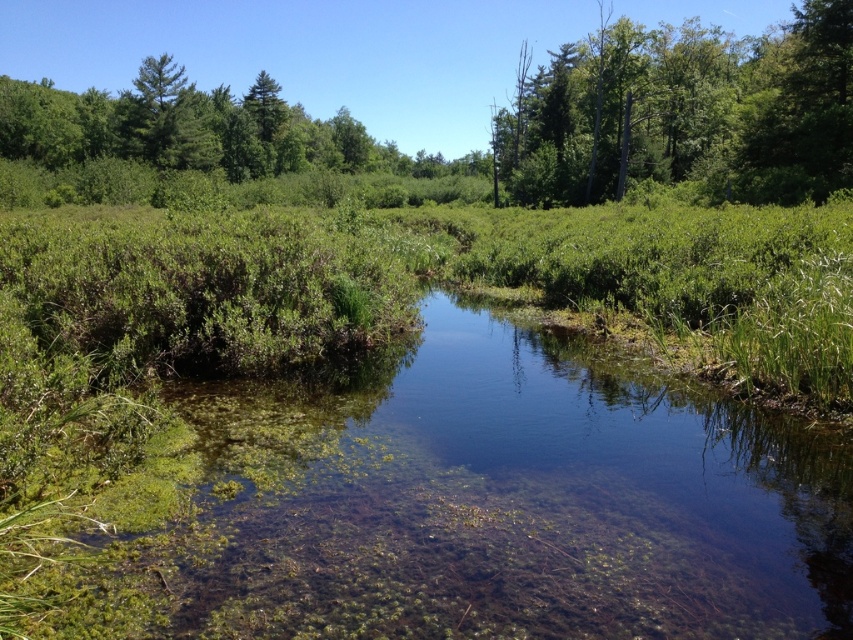
Is green algae-covered water at center to the left of green leafy trees at upper center from the viewer's perspective?

Indeed, green algae-covered water at center is positioned on the left side of green leafy trees at upper center.

Between green algae-covered water at center and green leafy trees at upper center, which one has less height?

With less height is green algae-covered water at center.

Measure the distance between point [773,419] and camera.

Point [773,419] and camera are 25.75 feet apart.

The image size is (853, 640). Identify the location of green algae-covered water at center. (490, 506).